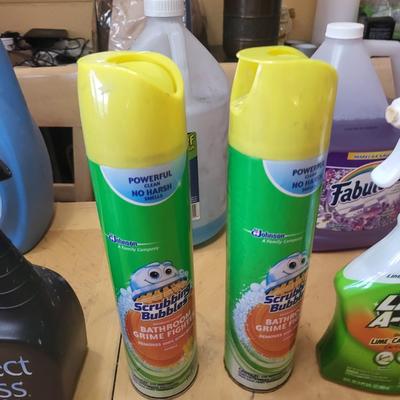
The image size is (400, 400). Identify the location of green can of scrubbing bubbles cleaner. (172, 234), (301, 214).